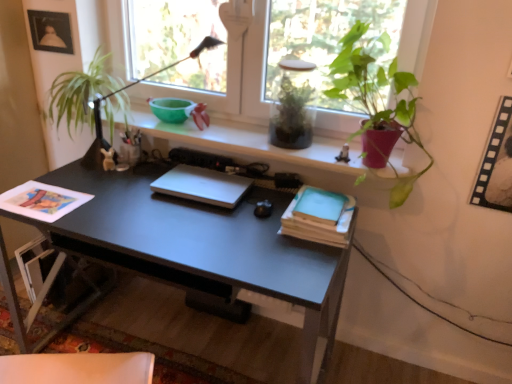
This screenshot has width=512, height=384. Find the location of `transparent glass window at upper center`. transparent glass window at upper center is located at coordinates (233, 66).

What do you see at coordinates (233, 66) in the screenshot?
I see `transparent glass window at upper center` at bounding box center [233, 66].

This screenshot has width=512, height=384. Describe the element at coordinates (319, 223) in the screenshot. I see `light blue paper at center right, which ranks as the 2th paperback book in top-to-bottom order` at that location.

Find the location of a particular element. light blue paper at center right, which ranks as the 2th paperback book in top-to-bottom order is located at coordinates (319, 223).

Measure the distance between point (328, 204) and camera.

Point (328, 204) is 4.85 feet away from camera.

Identify the location of light blue matte paper at center right, the second paperback book when ordered from bottom to top. (x=320, y=206).

What do you see at coordinates (292, 115) in the screenshot? This screenshot has height=384, width=512. I see `translucent glass terrarium at center, marked as the first houseplant in a left-to-right arrangement` at bounding box center [292, 115].

The width and height of the screenshot is (512, 384). I want to click on green matte plant at upper right, the 1th houseplant when ordered from right to left, so click(x=377, y=98).

Which is in front, matte white shelf at upper center or matte black picture frame at upper left, which ranks as the first picture frame in top-to-bottom order?

matte white shelf at upper center is more forward.

Is matte white shelf at upper center positioned with its back to matte black picture frame at upper left, the second picture frame when ordered from front to back?

No, matte white shelf at upper center's orientation is not away from matte black picture frame at upper left, the second picture frame when ordered from front to back.

From the image's perspective, would you say matte white shelf at upper center is positioned over matte black picture frame at upper left, the 2th picture frame positioned from the right?

No.

From a real-world perspective, is matte white shelf at upper center on matte black picture frame at upper left, the second picture frame when ordered from front to back?

No, from a real-world perspective, matte white shelf at upper center is not over matte black picture frame at upper left, the second picture frame when ordered from front to back

Is matte black picture frame at upper left, which ranks as the 1th picture frame in left-to-right order, at the back of filmstrip paper at upper right, which is the 1th picture frame from right to left?

No, matte black picture frame at upper left, which ranks as the 1th picture frame in left-to-right order, is not at the back of filmstrip paper at upper right, which is the 1th picture frame from right to left.

Measure the distance between filmstrip paper at upper right, arranged as the 2th picture frame when viewed from the left, and matte black picture frame at upper left, the second picture frame when ordered from front to back.

A distance of 6.10 feet exists between filmstrip paper at upper right, arranged as the 2th picture frame when viewed from the left, and matte black picture frame at upper left, the second picture frame when ordered from front to back.

Would you say filmstrip paper at upper right, which appears as the 1th picture frame when viewed from the front, is a long distance from matte black picture frame at upper left, the first picture frame viewed from the back?

Yes.

In the scene shown: Is filmstrip paper at upper right, marked as the 2th picture frame in a back-to-front arrangement, bigger than matte black picture frame at upper left, which appears as the second picture frame when ordered from the bottom?

Correct, filmstrip paper at upper right, marked as the 2th picture frame in a back-to-front arrangement, is larger in size than matte black picture frame at upper left, which appears as the second picture frame when ordered from the bottom.

Measure the distance between green leafy plant at left and filmstrip paper at upper right, arranged as the 2th picture frame when viewed from the left.

The distance of green leafy plant at left from filmstrip paper at upper right, arranged as the 2th picture frame when viewed from the left, is 1.56 meters.

Is filmstrip paper at upper right, arranged as the 2th picture frame when viewed from the left, located within green leafy plant at left?

No, filmstrip paper at upper right, arranged as the 2th picture frame when viewed from the left, is not a part of green leafy plant at left.

How different are the orientations of green leafy plant at left and filmstrip paper at upper right, which appears as the 1th picture frame when viewed from the front, in degrees?

There is a 1.76-degree angle between the facing directions of green leafy plant at left and filmstrip paper at upper right, which appears as the 1th picture frame when viewed from the front.

Consider the image. Considering the sizes of objects green leafy plant at left and filmstrip paper at upper right, marked as the 2th picture frame in a back-to-front arrangement, in the image provided, who is shorter, green leafy plant at left or filmstrip paper at upper right, marked as the 2th picture frame in a back-to-front arrangement,?

Standing shorter between the two is filmstrip paper at upper right, marked as the 2th picture frame in a back-to-front arrangement.

Based on the photo, from a real-world perspective, which object stands above the other?

green matte plant at upper right, which is counted as the second houseplant, starting from the left.

Does translucent glass terrarium at center, the second houseplant from the right, have a greater width compared to green matte plant at upper right, which is counted as the second houseplant, starting from the left?

No.

Is translucent glass terrarium at center, the second houseplant from the right, facing away from green matte plant at upper right, which is counted as the second houseplant, starting from the left?

No.

Which object is positioned more to the right, translucent glass terrarium at center, the second houseplant from the right, or green matte plant at upper right, the 1th houseplant when ordered from right to left?

green matte plant at upper right, the 1th houseplant when ordered from right to left, is more to the right.

Considering the relative sizes of white matte laptop at center and light blue paper at center right, which ranks as the 2th paperback book in top-to-bottom order, in the image provided, is white matte laptop at center thinner than light blue paper at center right, which ranks as the 2th paperback book in top-to-bottom order,?

Correct, the width of white matte laptop at center is less than that of light blue paper at center right, which ranks as the 2th paperback book in top-to-bottom order.

Which is closer to the camera, (185, 196) or (341, 234)?

Point (185, 196).

Can you confirm if white matte laptop at center is taller than light blue paper at center right, the 1th paperback book ordered from the bottom?

In fact, white matte laptop at center may be shorter than light blue paper at center right, the 1th paperback book ordered from the bottom.

Consider the image. From a real-world perspective, is filmstrip paper at upper right, which appears as the 1th picture frame when viewed from the front, on green matte plant at upper right, the 1th houseplant when ordered from right to left?

No.

Would you say filmstrip paper at upper right, which is the 1th picture frame from right to left, is inside or outside green matte plant at upper right, the 1th houseplant when ordered from right to left?

filmstrip paper at upper right, which is the 1th picture frame from right to left, is outside green matte plant at upper right, the 1th houseplant when ordered from right to left.

Locate an element on the screen. This screenshot has width=512, height=384. picture frame below the green matte plant at upper right, the 1th houseplant when ordered from right to left (from a real-world perspective) is located at coordinates (496, 163).

Is point (499, 183) closer or farther from the camera than point (407, 84)?

Point (499, 183) appears to be closer to the viewer than point (407, 84).

Is translucent glass terrarium at center, marked as the first houseplant in a left-to-right arrangement, next to matte white shelf at upper center and touching it?

They are not placed beside each other.

Considering the relative sizes of translucent glass terrarium at center, marked as the first houseplant in a left-to-right arrangement, and matte white shelf at upper center in the image provided, is translucent glass terrarium at center, marked as the first houseplant in a left-to-right arrangement, taller than matte white shelf at upper center?

Yes.

From the image's perspective, would you say translucent glass terrarium at center, the second houseplant from the right, is positioned over matte white shelf at upper center?

Yes, from the image's perspective, translucent glass terrarium at center, the second houseplant from the right, is above matte white shelf at upper center.

From the picture: Considering the positions of objects translucent glass terrarium at center, marked as the first houseplant in a left-to-right arrangement, and matte white shelf at upper center in the image provided, who is more to the right, translucent glass terrarium at center, marked as the first houseplant in a left-to-right arrangement, or matte white shelf at upper center?

translucent glass terrarium at center, marked as the first houseplant in a left-to-right arrangement.

Locate an element on the screen. window sill below the matte black picture frame at upper left, which appears as the second picture frame when ordered from the bottom (from a real-world perspective) is located at coordinates (266, 146).

You are a GUI agent. You are given a task and a screenshot of the screen. Output one action in this format:
    pyautogui.click(x=<x>, y=<y>)
    Task: Click on the picture frame on the right of matte black picture frame at upper left, which appears as the second picture frame when ordered from the bottom
    This screenshot has height=384, width=512.
    Given the screenshot: What is the action you would take?
    pyautogui.click(x=496, y=163)

When comparing their distances from light blue matte paper at center right, the second paperback book when ordered from bottom to top, does green matte plant at upper right, the 1th houseplant when ordered from right to left, or white matte laptop at center seem closer?

The object closer to light blue matte paper at center right, the second paperback book when ordered from bottom to top, is white matte laptop at center.

From the image, which object appears to be farther from green leafy plant at left, green matte plant at upper right, which is counted as the second houseplant, starting from the left, or light blue matte paper at center right, the first paperback book viewed from the top?

Based on the image, green matte plant at upper right, which is counted as the second houseplant, starting from the left, appears to be further to green leafy plant at left.

Which object lies further to the anchor point green matte plant at upper right, which is counted as the second houseplant, starting from the left, light blue paper at center right, which ranks as the 2th paperback book in top-to-bottom order, or white matte laptop at center?

white matte laptop at center is positioned further to the anchor green matte plant at upper right, which is counted as the second houseplant, starting from the left.

Which object lies further to the anchor point translucent glass terrarium at center, the second houseplant from the right, green leafy plant at left or light blue paper at center right, the 1th paperback book ordered from the bottom?

green leafy plant at left is further to translucent glass terrarium at center, the second houseplant from the right.

Considering their positions, is light blue matte paper at center right, the first paperback book viewed from the top, positioned further to light blue paper at center right, the 1th paperback book ordered from the bottom, than matte black picture frame at upper left, the second picture frame when ordered from front to back?

matte black picture frame at upper left, the second picture frame when ordered from front to back, is positioned further to the anchor light blue paper at center right, the 1th paperback book ordered from the bottom.

Estimate the real-world distances between objects in this image. Which object is further from white matte laptop at center, matte white shelf at upper center or black matte desk at center?

Among the two, matte white shelf at upper center is located further to white matte laptop at center.

From the image, which object appears to be nearer to light blue paper at center right, the 1th paperback book ordered from the bottom, green matte plant at upper right, the 1th houseplant when ordered from right to left, or filmstrip paper at upper right, which is the 1th picture frame from right to left?

Among the two, green matte plant at upper right, the 1th houseplant when ordered from right to left, is located nearer to light blue paper at center right, the 1th paperback book ordered from the bottom.

From the image, which object appears to be farther from green matte plant at upper right, the 1th houseplant when ordered from right to left, matte white shelf at upper center or black matte desk at center?

Based on the image, black matte desk at center appears to be further to green matte plant at upper right, the 1th houseplant when ordered from right to left.

Identify the location of laptop between black matte desk at center and filmstrip paper at upper right, the 1th picture frame ordered from the bottom, from left to right. The image size is (512, 384). [202, 185].

This screenshot has width=512, height=384. What are the coordinates of `laptop between green leafy plant at left and light blue paper at center right, the 1th paperback book ordered from the bottom, in the horizontal direction` in the screenshot? It's located at (202, 185).

Identify the location of window sill between matte black picture frame at upper left, the second picture frame when ordered from front to back, and light blue paper at center right, which ranks as the 2th paperback book in top-to-bottom order. (266, 146).

I want to click on window sill between matte black picture frame at upper left, which appears as the second picture frame when ordered from the bottom, and black matte desk at center vertically, so click(266, 146).